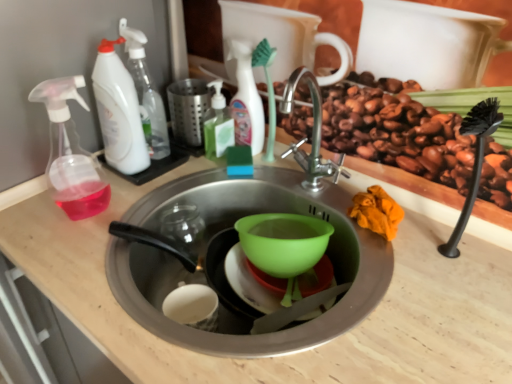
Measure the distance between point [243,130] and camera.

Point [243,130] is 1.00 meters away from camera.

Where is `transparent plastic spray bottle at left`? This screenshot has width=512, height=384. transparent plastic spray bottle at left is located at coordinates (70, 153).

This screenshot has width=512, height=384. I want to click on white plastic spray bottle at upper left, placed as the 3th cleaning product when sorted from right to left, so click(x=146, y=92).

Find the location of a particular element. The width and height of the screenshot is (512, 384). white matte bottle at upper center, the first cleaning product from the right is located at coordinates (246, 100).

Is green liquid soap at upper center, positioned as the second cleaning product in right-to-left order, to the left of white plastic spray bottle at upper left, which appears as the 4th cleaning product when viewed from the right, from the viewer's perspective?

No.

Is green liquid soap at upper center, acting as the 3th cleaning product starting from the left, directly adjacent to white plastic spray bottle at upper left, which appears as the 4th cleaning product when viewed from the right?

green liquid soap at upper center, acting as the 3th cleaning product starting from the left, and white plastic spray bottle at upper left, which appears as the 4th cleaning product when viewed from the right, are clearly separated.

From a real-world perspective, is green liquid soap at upper center, positioned as the second cleaning product in right-to-left order, positioned under white plastic spray bottle at upper left, which appears as the 4th cleaning product when viewed from the right, based on gravity?

Yes, from a real-world perspective, green liquid soap at upper center, positioned as the second cleaning product in right-to-left order, is below white plastic spray bottle at upper left, which appears as the 4th cleaning product when viewed from the right.

Is green liquid soap at upper center, acting as the 3th cleaning product starting from the left, wider or thinner than white matte bottle at upper center, arranged as the fourth cleaning product when viewed from the left?

Clearly, green liquid soap at upper center, acting as the 3th cleaning product starting from the left, has more width compared to white matte bottle at upper center, arranged as the fourth cleaning product when viewed from the left.

Considering the sizes of objects green liquid soap at upper center, acting as the 3th cleaning product starting from the left, and white matte bottle at upper center, the first cleaning product from the right, in the image provided, who is taller, green liquid soap at upper center, acting as the 3th cleaning product starting from the left, or white matte bottle at upper center, the first cleaning product from the right,?

white matte bottle at upper center, the first cleaning product from the right, is taller.

What's the angular difference between green liquid soap at upper center, positioned as the second cleaning product in right-to-left order, and white matte bottle at upper center, the first cleaning product from the right,'s facing directions?

green liquid soap at upper center, positioned as the second cleaning product in right-to-left order, and white matte bottle at upper center, the first cleaning product from the right, are facing 0.00956 degrees away from each other.

How different are the orientations of white plastic spray bottle at upper left, the 1th cleaning product viewed from the left, and light wood counter top at center in degrees?

1.58 degrees separate the facing orientations of white plastic spray bottle at upper left, the 1th cleaning product viewed from the left, and light wood counter top at center.

Is white plastic spray bottle at upper left, which appears as the 4th cleaning product when viewed from the right, at the right side of light wood counter top at center?

No.

Are white plastic spray bottle at upper left, the 1th cleaning product viewed from the left, and light wood counter top at center located far from each other?

white plastic spray bottle at upper left, the 1th cleaning product viewed from the left, is actually quite close to light wood counter top at center.

Consider the image. In the image, is white plastic spray bottle at upper left, which appears as the 4th cleaning product when viewed from the right, positioned in front of or behind light wood counter top at center?

white plastic spray bottle at upper left, which appears as the 4th cleaning product when viewed from the right, is positioned farther from the viewer than light wood counter top at center.

Locate an element on the screen. This screenshot has height=384, width=512. soap dispenser on the left of white plastic spray bottle at upper left, placed as the 3th cleaning product when sorted from right to left is located at coordinates (70, 153).

From a real-world perspective, who is located lower, white plastic spray bottle at upper left, the second cleaning product positioned from the left, or transparent plastic spray bottle at left?

In real-world perspective, transparent plastic spray bottle at left is lower.

Would you say white plastic spray bottle at upper left, the second cleaning product positioned from the left, is outside transparent plastic spray bottle at left?

Yes, white plastic spray bottle at upper left, the second cleaning product positioned from the left, is not within transparent plastic spray bottle at left.

From the image's perspective, is white plastic spray bottle at upper left, placed as the 3th cleaning product when sorted from right to left, positioned above or below transparent plastic spray bottle at left?

Clearly, from the image's perspective, white plastic spray bottle at upper left, placed as the 3th cleaning product when sorted from right to left, is above transparent plastic spray bottle at left.

Consider the image. In the image, is light wood counter top at center on the left side or the right side of white plastic spray bottle at upper left, the second cleaning product positioned from the left?

Clearly, light wood counter top at center is on the right of white plastic spray bottle at upper left, the second cleaning product positioned from the left, in the image.

Can you confirm if light wood counter top at center is shorter than white plastic spray bottle at upper left, placed as the 3th cleaning product when sorted from right to left?

Incorrect, the height of light wood counter top at center does not fall short of that of white plastic spray bottle at upper left, placed as the 3th cleaning product when sorted from right to left.

Is light wood counter top at center not near white plastic spray bottle at upper left, placed as the 3th cleaning product when sorted from right to left?

No.

From a real-world perspective, is light wood counter top at center positioned above or below white plastic spray bottle at upper left, the second cleaning product positioned from the left?

From a real-world perspective, light wood counter top at center is physically below white plastic spray bottle at upper left, the second cleaning product positioned from the left.

Does white matte bottle at upper center, the first cleaning product from the right, come behind white plastic spray bottle at upper left, the second cleaning product positioned from the left?

That is True.

Would you say white matte bottle at upper center, arranged as the fourth cleaning product when viewed from the left, is to the left or to the right of white plastic spray bottle at upper left, the second cleaning product positioned from the left, in the picture?

white matte bottle at upper center, arranged as the fourth cleaning product when viewed from the left, is positioned on white plastic spray bottle at upper left, the second cleaning product positioned from the left,'s right side.

Who is shorter, white matte bottle at upper center, the first cleaning product from the right, or white plastic spray bottle at upper left, placed as the 3th cleaning product when sorted from right to left?

white matte bottle at upper center, the first cleaning product from the right, is shorter.

From a real-world perspective, is white matte bottle at upper center, the first cleaning product from the right, located beneath white plastic spray bottle at upper left, placed as the 3th cleaning product when sorted from right to left?

Yes, from a real-world perspective, white matte bottle at upper center, the first cleaning product from the right, is beneath white plastic spray bottle at upper left, placed as the 3th cleaning product when sorted from right to left.

Considering the sizes of objects white plastic spray bottle at upper left, placed as the 3th cleaning product when sorted from right to left, and white matte bottle at upper center, the first cleaning product from the right, in the image provided, who is thinner, white plastic spray bottle at upper left, placed as the 3th cleaning product when sorted from right to left, or white matte bottle at upper center, the first cleaning product from the right,?

white matte bottle at upper center, the first cleaning product from the right, is thinner.

From a real-world perspective, is white plastic spray bottle at upper left, the second cleaning product positioned from the left, over white matte bottle at upper center, the first cleaning product from the right?

Correct, in the physical world, white plastic spray bottle at upper left, the second cleaning product positioned from the left, is higher than white matte bottle at upper center, the first cleaning product from the right.

Which is more to the left, white plastic spray bottle at upper left, the second cleaning product positioned from the left, or white matte bottle at upper center, arranged as the fourth cleaning product when viewed from the left?

white plastic spray bottle at upper left, the second cleaning product positioned from the left, is more to the left.

Between point (156, 121) and point (251, 137), which one is positioned in front?

Positioned in front is point (156, 121).

This screenshot has width=512, height=384. I want to click on cleaning product below the white plastic spray bottle at upper left, the 1th cleaning product viewed from the left (from the image's perspective), so click(217, 124).

Where is `cleaning product below the white matte bottle at upper center, the first cleaning product from the right (from a real-world perspective)`? This screenshot has width=512, height=384. cleaning product below the white matte bottle at upper center, the first cleaning product from the right (from a real-world perspective) is located at coordinates (217, 124).

Which object lies nearer to the anchor point white plastic spray bottle at upper left, which appears as the 4th cleaning product when viewed from the right, light wood counter top at center or green liquid soap at upper center, acting as the 3th cleaning product starting from the left?

green liquid soap at upper center, acting as the 3th cleaning product starting from the left, is positioned closer to the anchor white plastic spray bottle at upper left, which appears as the 4th cleaning product when viewed from the right.

Which object lies nearer to the anchor point white plastic spray bottle at upper left, which appears as the 4th cleaning product when viewed from the right, white matte bottle at upper center, arranged as the fourth cleaning product when viewed from the left, or transparent plastic spray bottle at left?

The object closer to white plastic spray bottle at upper left, which appears as the 4th cleaning product when viewed from the right, is transparent plastic spray bottle at left.

Considering their positions, is white plastic spray bottle at upper left, placed as the 3th cleaning product when sorted from right to left, positioned closer to white matte bottle at upper center, the first cleaning product from the right, than light wood counter top at center?

white plastic spray bottle at upper left, placed as the 3th cleaning product when sorted from right to left, is closer to white matte bottle at upper center, the first cleaning product from the right.

From the picture: Which object lies further to the anchor point white plastic spray bottle at upper left, which appears as the 4th cleaning product when viewed from the right, white plastic spray bottle at upper left, the second cleaning product positioned from the left, or white matte bottle at upper center, arranged as the fourth cleaning product when viewed from the left?

Among the two, white matte bottle at upper center, arranged as the fourth cleaning product when viewed from the left, is located further to white plastic spray bottle at upper left, which appears as the 4th cleaning product when viewed from the right.

Looking at the image, which one is located closer to green liquid soap at upper center, positioned as the second cleaning product in right-to-left order, white matte bottle at upper center, arranged as the fourth cleaning product when viewed from the left, or light wood counter top at center?

white matte bottle at upper center, arranged as the fourth cleaning product when viewed from the left, is positioned closer to the anchor green liquid soap at upper center, positioned as the second cleaning product in right-to-left order.

From the image, which object appears to be farther from white matte bottle at upper center, arranged as the fourth cleaning product when viewed from the left, white plastic spray bottle at upper left, which appears as the 4th cleaning product when viewed from the right, or light wood counter top at center?

The object further to white matte bottle at upper center, arranged as the fourth cleaning product when viewed from the left, is light wood counter top at center.

Considering their positions, is transparent plastic spray bottle at left positioned closer to white matte bottle at upper center, the first cleaning product from the right, than green liquid soap at upper center, acting as the 3th cleaning product starting from the left?

green liquid soap at upper center, acting as the 3th cleaning product starting from the left, lies closer to white matte bottle at upper center, the first cleaning product from the right, than the other object.

Which object lies nearer to the anchor point light wood counter top at center, white matte bottle at upper center, the first cleaning product from the right, or transparent plastic spray bottle at left?

transparent plastic spray bottle at left is closer to light wood counter top at center.

In order to click on cleaning product between transparent plastic spray bottle at left and white plastic spray bottle at upper left, placed as the 3th cleaning product when sorted from right to left, along the z-axis in this screenshot , I will do `click(119, 112)`.

The image size is (512, 384). In order to click on cleaning product between white plastic spray bottle at upper left, which appears as the 4th cleaning product when viewed from the right, and light wood counter top at center vertically in this screenshot , I will do `click(217, 124)`.

You are a GUI agent. You are given a task and a screenshot of the screen. Output one action in this format:
    pyautogui.click(x=<x>, y=<y>)
    Task: Click on the soap dispenser that lies between white matte bottle at upper center, the first cleaning product from the right, and light wood counter top at center from top to bottom
    This screenshot has width=512, height=384.
    Given the screenshot: What is the action you would take?
    pyautogui.click(x=70, y=153)

In order to click on soap dispenser that lies between green liquid soap at upper center, acting as the 3th cleaning product starting from the left, and light wood counter top at center from top to bottom in this screenshot , I will do click(70, 153).